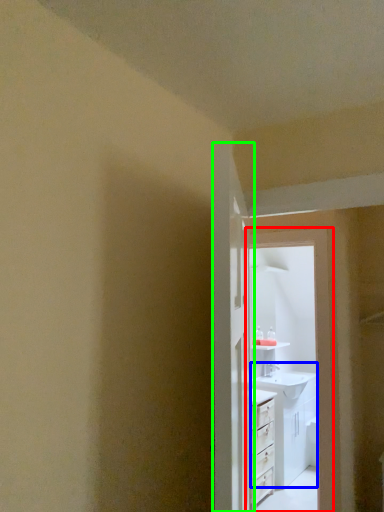
Question: Considering the real-world distances, which object is closest to screen door (highlighted by a red box)? sink (highlighted by a blue box) or door (highlighted by a green box).

Choices:
 (A) sink
 (B) door

Answer: (B)